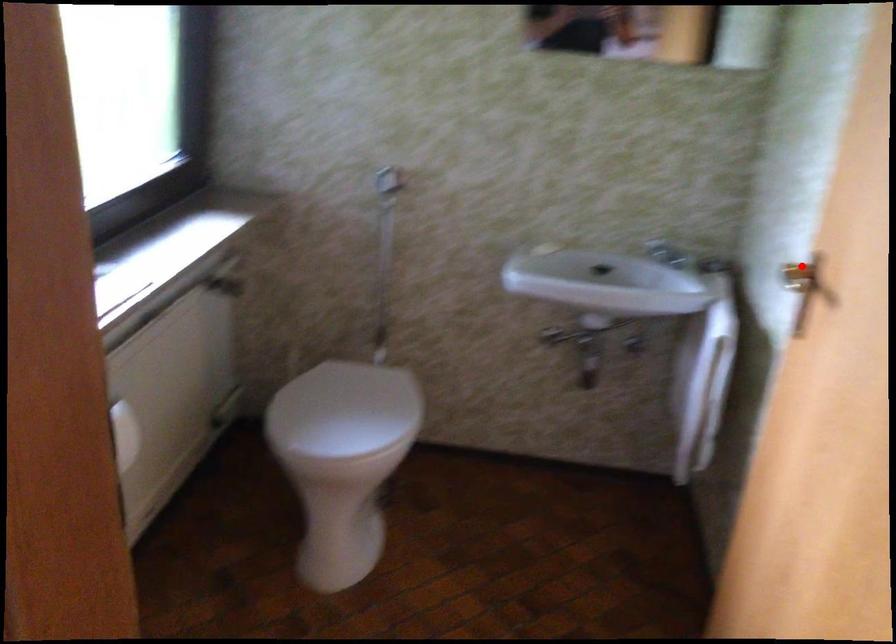
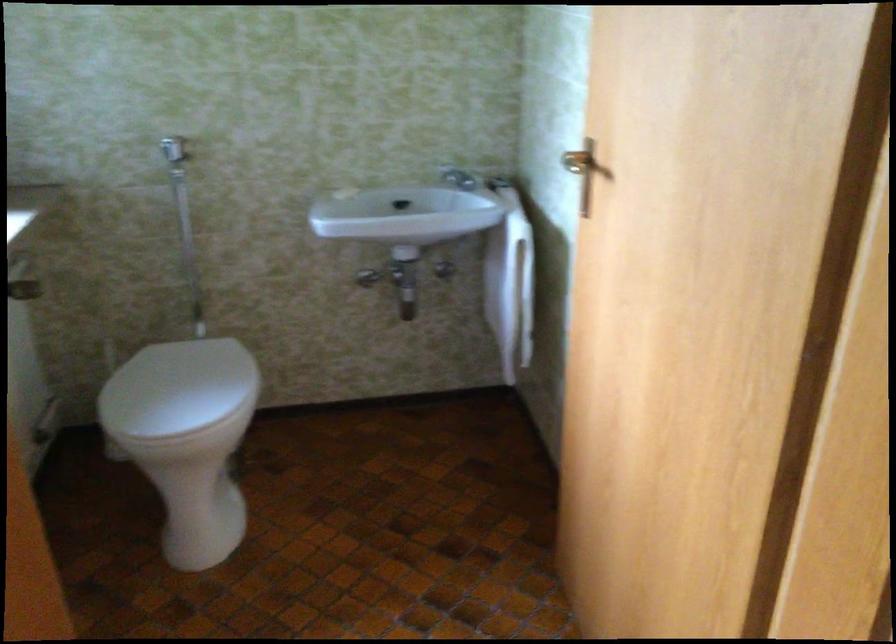
Locate, in the second image, the point that corresponds to the highlighted location in the first image.

(575, 162)